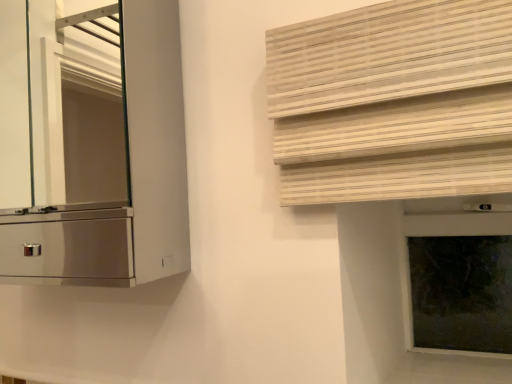
Find the location of a particular element. Image resolution: width=512 pixels, height=384 pixels. dark glass window frame at right is located at coordinates (459, 282).

Looking at this image, from the image's perspective, does dark glass window frame at right appear lower than natural wood blinds at upper right?

Indeed, from the image's perspective, dark glass window frame at right is shown beneath natural wood blinds at upper right.

Is the surface of dark glass window frame at right in direct contact with natural wood blinds at upper right?

No, dark glass window frame at right is not with natural wood blinds at upper right.

Considering the relative positions of dark glass window frame at right and natural wood blinds at upper right in the image provided, is dark glass window frame at right to the right of natural wood blinds at upper right from the viewer's perspective?

Yes.

Consider the image. Is dark glass window frame at right positioned with its back to natural wood blinds at upper right?

No.

From a real-world perspective, is natural wood blinds at upper right above or below dark glass window frame at right?

From a real-world perspective, natural wood blinds at upper right is physically above dark glass window frame at right.

Where is `shutter in front of the dark glass window frame at right`? This screenshot has height=384, width=512. shutter in front of the dark glass window frame at right is located at coordinates (393, 102).

Is point (426, 27) closer to viewer compared to point (446, 319)?

Yes, point (426, 27) is closer to viewer.

Between natural wood blinds at upper right and dark glass window frame at right, which one has smaller size?

Smaller between the two is dark glass window frame at right.

Is dark glass window frame at right smaller than metallic silver cabinet at left?

Indeed, dark glass window frame at right has a smaller size compared to metallic silver cabinet at left.

Which is in front, dark glass window frame at right or metallic silver cabinet at left?

Positioned in front is metallic silver cabinet at left.

Is dark glass window frame at right directly adjacent to metallic silver cabinet at left?

There is a gap between dark glass window frame at right and metallic silver cabinet at left.

From the image's perspective, is dark glass window frame at right under metallic silver cabinet at left?

Indeed, from the image's perspective, dark glass window frame at right is shown beneath metallic silver cabinet at left.

Between natural wood blinds at upper right and metallic silver cabinet at left, which one is positioned in front?

natural wood blinds at upper right is more forward.

In the scene shown: From the image's perspective, is natural wood blinds at upper right positioned above or below metallic silver cabinet at left?

Based on their image positions, natural wood blinds at upper right is located beneath metallic silver cabinet at left.

Is natural wood blinds at upper right facing towards metallic silver cabinet at left?

No, natural wood blinds at upper right is not oriented towards metallic silver cabinet at left.

Can you tell me how much natural wood blinds at upper right and metallic silver cabinet at left differ in facing direction?

The facing directions of natural wood blinds at upper right and metallic silver cabinet at left are 6.17 degrees apart.

I want to click on cabinetry above the dark glass window frame at right (from a real-world perspective), so click(93, 145).

Is metallic silver cabinet at left positioned with its back to dark glass window frame at right?

No, dark glass window frame at right is not at the back of metallic silver cabinet at left.

Which object is closer to the camera taking this photo, metallic silver cabinet at left or dark glass window frame at right?

metallic silver cabinet at left is in front.

Is point (15, 164) farther from camera compared to point (492, 126)?

Yes.

Do you think metallic silver cabinet at left is within natural wood blinds at upper right, or outside of it?

metallic silver cabinet at left is not inside natural wood blinds at upper right, it's outside.

Where is `shutter that is in front of the dark glass window frame at right`? This screenshot has width=512, height=384. shutter that is in front of the dark glass window frame at right is located at coordinates (393, 102).

This screenshot has width=512, height=384. What are the coordinates of `window frame that is under the natural wood blinds at upper right (from a real-world perspective)` in the screenshot? It's located at (459, 282).

Which object lies nearer to the anchor point metallic silver cabinet at left, natural wood blinds at upper right or dark glass window frame at right?

Among the two, dark glass window frame at right is located nearer to metallic silver cabinet at left.

From the image, which object appears to be nearer to natural wood blinds at upper right, metallic silver cabinet at left or dark glass window frame at right?

The object closer to natural wood blinds at upper right is dark glass window frame at right.

Looking at the image, which one is located closer to dark glass window frame at right, natural wood blinds at upper right or metallic silver cabinet at left?

natural wood blinds at upper right.

Estimate the real-world distances between objects in this image. Which object is closer to metallic silver cabinet at left, dark glass window frame at right or natural wood blinds at upper right?

The object closer to metallic silver cabinet at left is dark glass window frame at right.

Looking at the image, which one is located further to natural wood blinds at upper right, dark glass window frame at right or metallic silver cabinet at left?

metallic silver cabinet at left is positioned further to the anchor natural wood blinds at upper right.

When comparing their distances from dark glass window frame at right, does metallic silver cabinet at left or natural wood blinds at upper right seem closer?

natural wood blinds at upper right is positioned closer to the anchor dark glass window frame at right.

This screenshot has width=512, height=384. What are the coordinates of `shutter between metallic silver cabinet at left and dark glass window frame at right in the horizontal direction` in the screenshot? It's located at (393, 102).